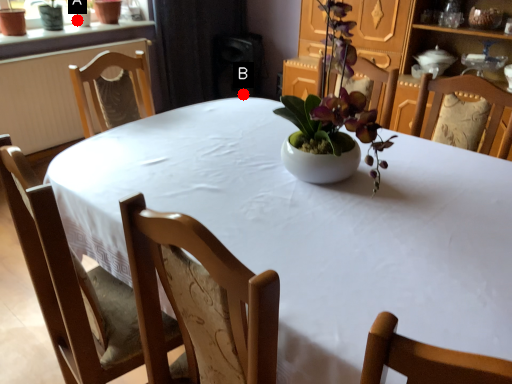
Question: Two points are circled on the image, labeled by A and B beside each circle. Which of the following is the farthest from the observer?

Choices:
 (A) A is further
 (B) B is further

Answer: (B)